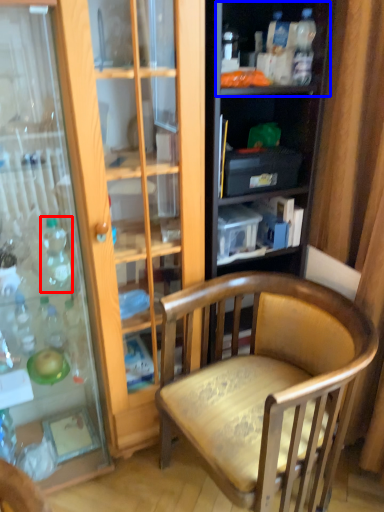
Question: Which object is further to the camera taking this photo, bottle (highlighted by a red box) or shelf (highlighted by a blue box)?

Choices:
 (A) bottle
 (B) shelf

Answer: (B)